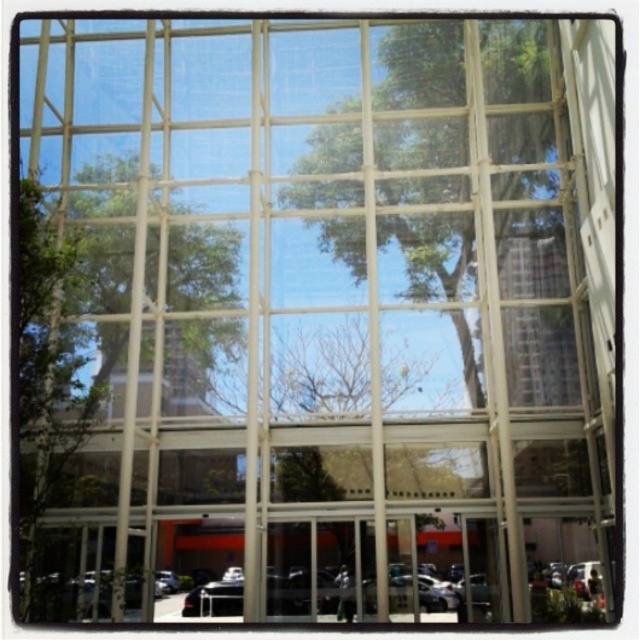
Question: In this image, where is green leafy tree at center located relative to green leafy tree at upper left?

Choices:
 (A) left
 (B) right

Answer: (B)

Question: Which object appears closest to the camera in this image?

Choices:
 (A) green leafy tree at center
 (B) green leafy tree at upper left

Answer: (B)

Question: Is green leafy tree at center in front of green leafy tree at upper left?

Choices:
 (A) no
 (B) yes

Answer: (A)

Question: Is green leafy tree at center in front of green leafy tree at upper left?

Choices:
 (A) no
 (B) yes

Answer: (A)